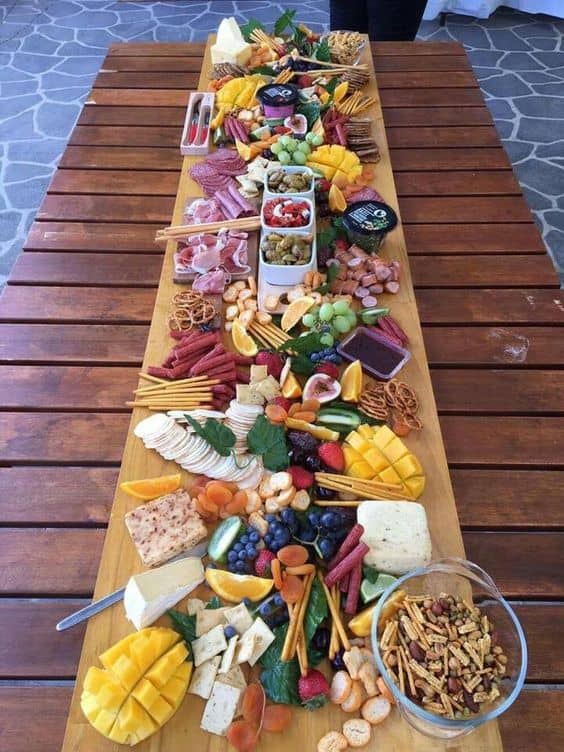
Find the location of a particular element. Image resolution: width=564 pixels, height=752 pixels. glass bowl is located at coordinates (456, 572).